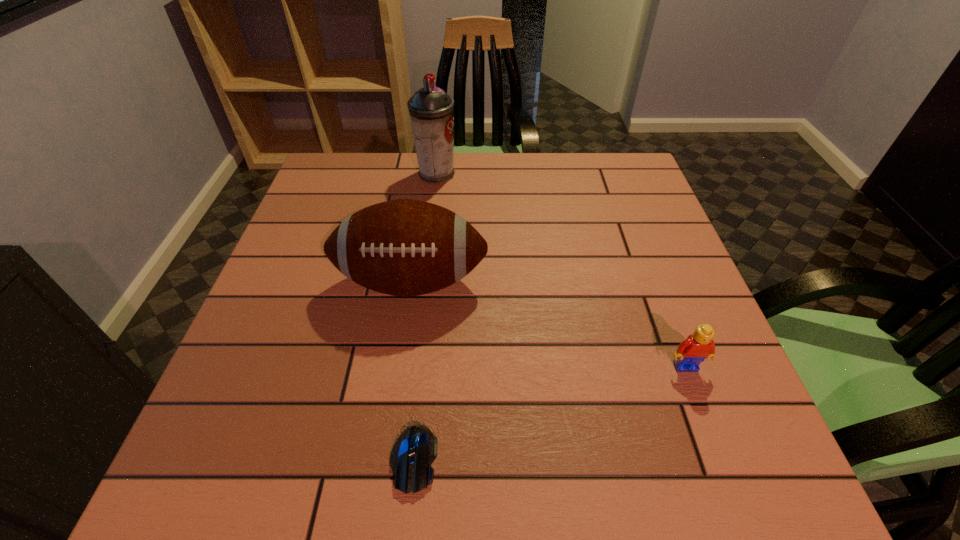
This screenshot has height=540, width=960. In the image, there is a desktop. What are the coordinates of `free space at the far right corner` in the screenshot? It's located at (617, 173).

Locate an element on the screen. vacant space at the near right corner of the desktop is located at coordinates (665, 450).

This screenshot has height=540, width=960. Find the location of `vacant space in between the third tallest object and the computer mouse`. vacant space in between the third tallest object and the computer mouse is located at coordinates coord(550,413).

Locate an element on the screen. free spot between the rightmost object and the nearest object is located at coordinates (550, 413).

Locate an element on the screen. This screenshot has width=960, height=540. free space that is in between the nearest object and the second farthest object is located at coordinates (413, 370).

Locate an element on the screen. free space that is in between the second tallest object and the nearest object is located at coordinates (413, 370).

Where is `free space between the Lego and the shortest object`? This screenshot has height=540, width=960. free space between the Lego and the shortest object is located at coordinates (550, 413).

The height and width of the screenshot is (540, 960). Find the location of `free point between the shortest object and the second tallest object`. free point between the shortest object and the second tallest object is located at coordinates (413, 370).

This screenshot has width=960, height=540. I want to click on free space that is in between the computer mouse and the rightmost object, so click(x=550, y=413).

Find the location of a particular element. This screenshot has width=960, height=540. empty space that is in between the second nearest object and the third shortest object is located at coordinates (548, 324).